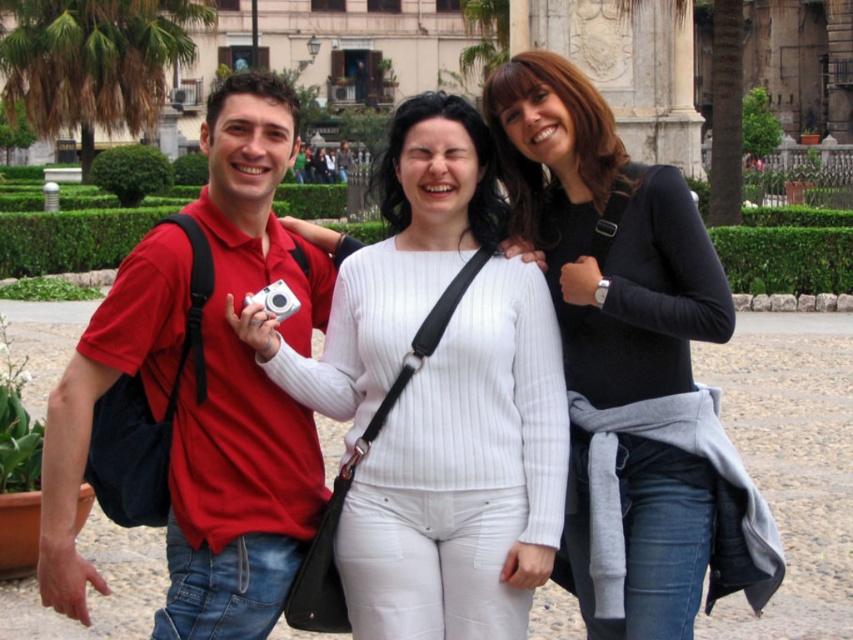
Is white ribbed sweater at center shorter than black matte sweater at center?

Correct, white ribbed sweater at center is not as tall as black matte sweater at center.

Which is behind, point (488, 429) or point (691, 209)?

The point (691, 209) is more distant.

Is point (438, 353) closer to camera compared to point (637, 339)?

Yes, it is in front of point (637, 339).

You are a GUI agent. You are given a task and a screenshot of the screen. Output one action in this format:
    pyautogui.click(x=<x>, y=<y>)
    Task: Click on the white ribbed sweater at center
    
    Given the screenshot: What is the action you would take?
    pyautogui.click(x=463, y=476)

Between matte red shirt at center and silver metallic camera at center, which one has more height?

With more height is matte red shirt at center.

The image size is (853, 640). In order to click on matte red shirt at center in this screenshot , I will do `click(242, 387)`.

Find the location of `matte red shirt at center`. matte red shirt at center is located at coordinates (242, 387).

Who is higher up, white ribbed sweater at center or silver metallic camera at center?

Positioned higher is silver metallic camera at center.

Does point (474, 129) come closer to viewer compared to point (288, 316)?

No, (474, 129) is behind (288, 316).

Image resolution: width=853 pixels, height=640 pixels. I want to click on white ribbed sweater at center, so click(463, 476).